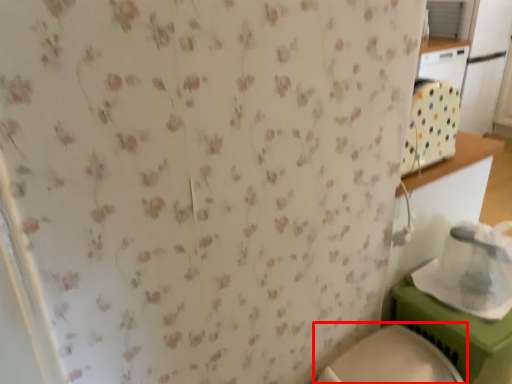
Question: From the image's perspective, what is the correct spatial positioning of toilet (annotated by the red box) in reference to appliance?

Choices:
 (A) above
 (B) below

Answer: (B)